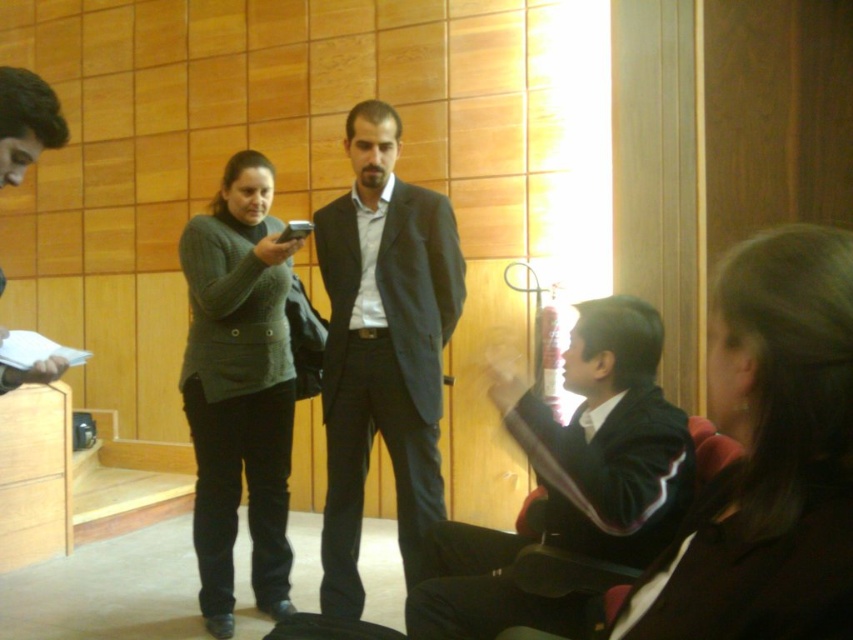
You are standing in the room and want to move from point A to point B. Point A is located at coordinates point (607, 394) and point B is at point (24, 109). Which point is closer to you?

Point A at coordinates point (607, 394) is closer to you than point B at point (24, 109) because it is further to the viewer.

You are organizing a charity event and need to decide which jacket to use for the photo shoot. The black matte jacket at lower right and the matte black jacket at left are both options. Based on their sizes, which one would be more suitable for a full body shot to emphasize the jacket?

The black matte jacket at lower right is wider than the matte black jacket at left, so it would be more suitable for a full body shot to emphasize the jacket.

You are a photographer setting up for a group photo. You need to position yourself so that both the dark brown hair at lower right and the knit sweater at center are in your camera frame. Given that your camera has a 5 foot wide lens, will you be able to capture both subjects in the same shot?

The dark brown hair at lower right and knit sweater at center are 6.75 feet apart, which is wider than the camera lens width of 5 feet. Therefore, you will not be able to capture both subjects in the same shot.